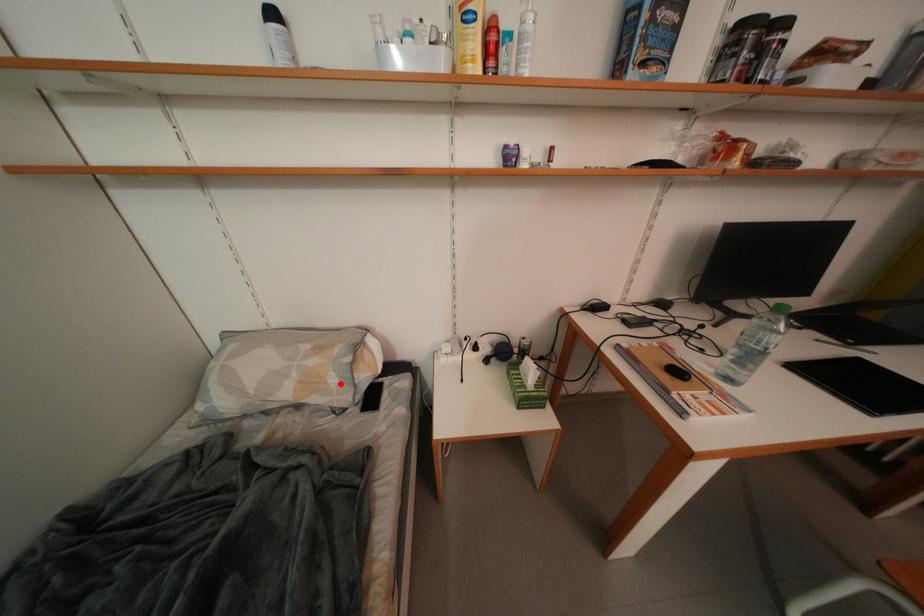
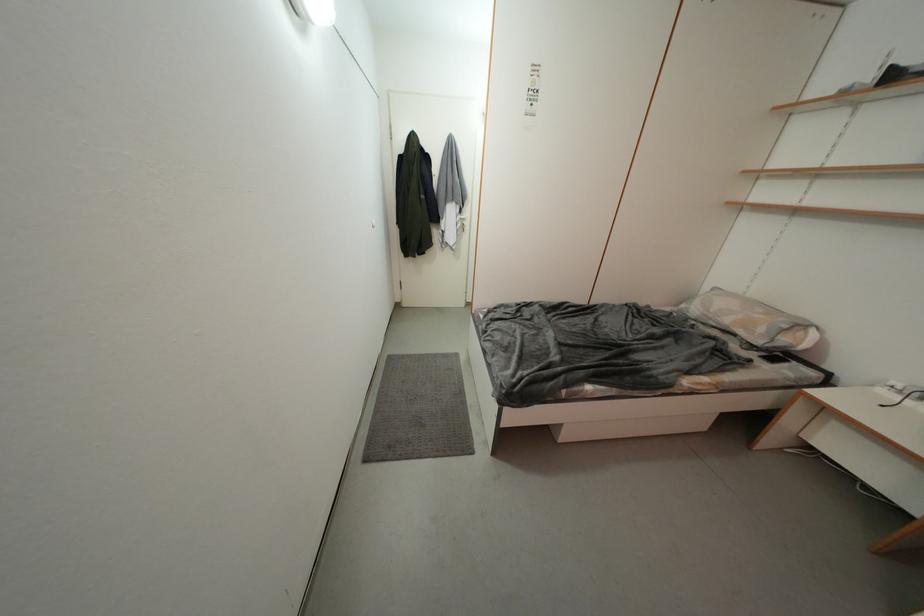
In the second image, find the point that corresponds to the highlighted location in the first image.

(769, 333)